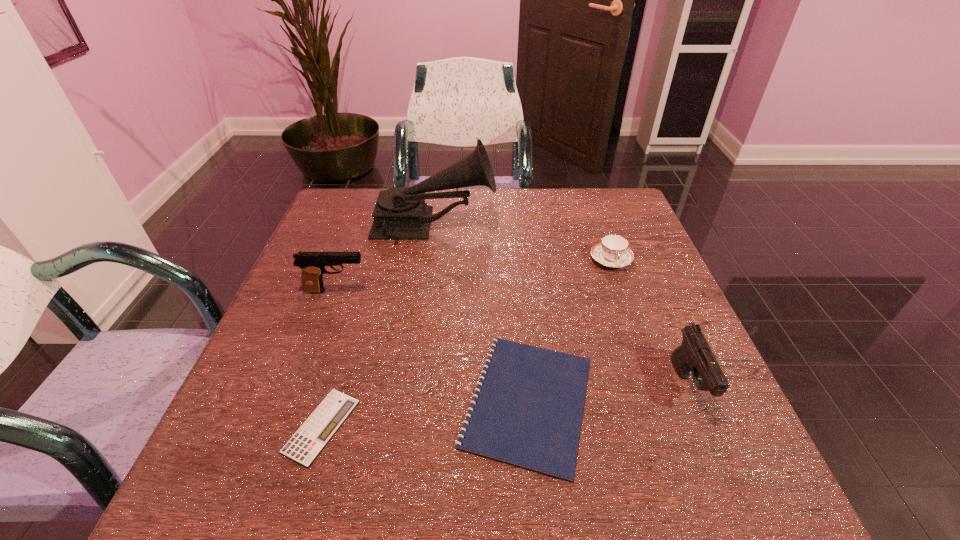
I want to click on vacant space located 0.080m at the barrel of the farther pistol, so click(x=402, y=291).

You are a GUI agent. You are given a task and a screenshot of the screen. Output one action in this format:
    pyautogui.click(x=<x>, y=<y>)
    Task: Click on the blank area located on the side with the handle of the second farthest object
    Image resolution: width=960 pixels, height=540 pixels.
    Given the screenshot: What is the action you would take?
    pyautogui.click(x=661, y=401)

In order to click on vacant region located on the right of the notepad in this screenshot , I will do `click(632, 402)`.

Locate an element on the screen. This screenshot has height=540, width=960. free space located on the right of the calculator is located at coordinates (412, 426).

Identify the location of object positioned at the far edge. (400, 213).

This screenshot has height=540, width=960. In order to click on notepad located at the near edge in this screenshot , I will do `click(529, 412)`.

The width and height of the screenshot is (960, 540). Identify the location of calculator positioned at the near edge. (310, 439).

Where is `phonograph_record located at the left edge`? phonograph_record located at the left edge is located at coordinates (400, 213).

At what (x,y) coordinates should I click in order to perform the action: click on pistol at the left edge. Please return your answer as a coordinate pair (x, y). The image size is (960, 540). Looking at the image, I should click on (313, 264).

Where is `calculator located in the left edge section of the desktop`? This screenshot has height=540, width=960. calculator located in the left edge section of the desktop is located at coordinates (310, 439).